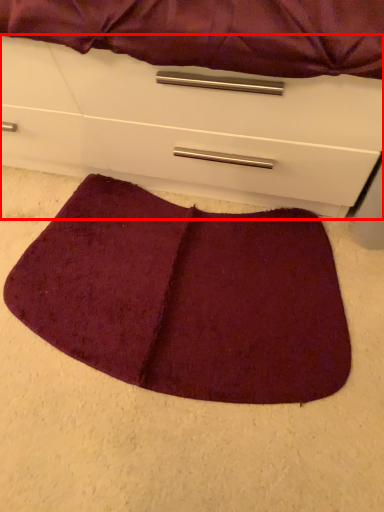
Question: From the image's perspective, what is the correct spatial relationship of chest of drawers (annotated by the red box) in relation to mat?

Choices:
 (A) below
 (B) above

Answer: (B)